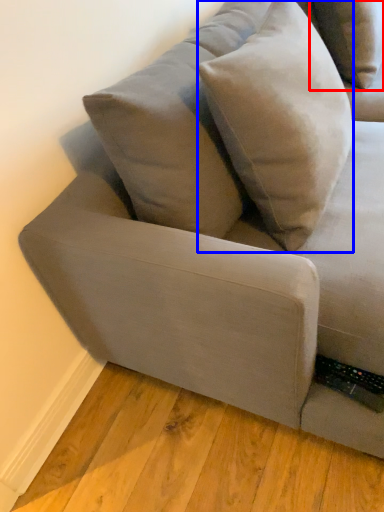
Question: Which of the following is the farthest to the observer, pillow (highlighted by a red box) or throw pillow (highlighted by a blue box)?

Choices:
 (A) pillow
 (B) throw pillow

Answer: (A)